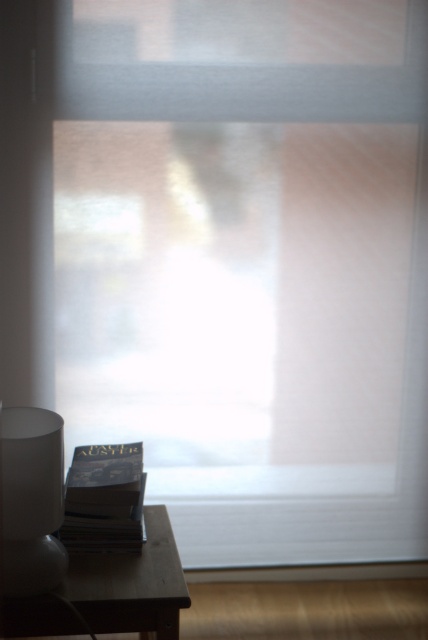
Question: Which of the following is the farthest from the observer?

Choices:
 (A) (133, 557)
 (B) (109, 468)
 (C) (8, 476)

Answer: (B)

Question: Considering the relative positions of wooden table at lower left and matte black book at lower left in the image provided, where is wooden table at lower left located with respect to matte black book at lower left?

Choices:
 (A) left
 (B) right

Answer: (B)

Question: Which object is closer to the camera taking this photo?

Choices:
 (A) matte black book at lower left
 (B) wooden table at lower left
 (C) white frosted glass lamp at lower left

Answer: (C)

Question: Where is wooden table at lower left located in relation to white frosted glass lamp at lower left in the image?

Choices:
 (A) below
 (B) above

Answer: (A)

Question: Does white frosted glass lamp at lower left appear on the left side of matte black book at lower left?

Choices:
 (A) no
 (B) yes

Answer: (B)

Question: Which point appears farthest from the camera in this image?

Choices:
 (A) (71, 496)
 (B) (163, 561)
 (C) (48, 456)

Answer: (A)